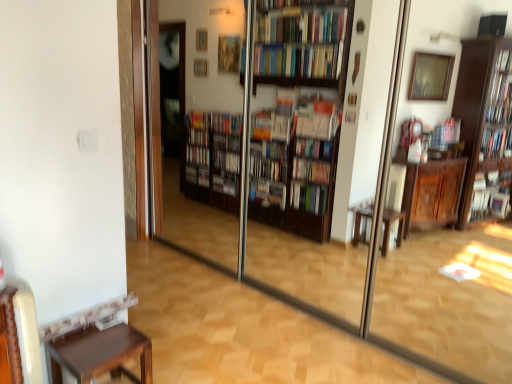
Where is `brown wood stool at lower left`? brown wood stool at lower left is located at coordinates (96, 346).

The image size is (512, 384). What do you see at coordinates (96, 346) in the screenshot? I see `brown wood stool at lower left` at bounding box center [96, 346].

Find the location of a particular element. transparent glass screen door at center is located at coordinates (271, 195).

The width and height of the screenshot is (512, 384). Describe the element at coordinates (271, 195) in the screenshot. I see `transparent glass screen door at center` at that location.

The width and height of the screenshot is (512, 384). I want to click on brown wood stool at lower left, so click(x=96, y=346).

Considering the relative positions of transparent glass screen door at center and brown wood stool at lower left in the image provided, is transparent glass screen door at center to the left of brown wood stool at lower left from the viewer's perspective?

No, transparent glass screen door at center is not to the left of brown wood stool at lower left.

Is transparent glass screen door at center in front of or behind brown wood stool at lower left in the image?

transparent glass screen door at center is positioned closer to the viewer than brown wood stool at lower left.

Does point (330, 29) appear closer or farther from the camera than point (80, 370)?

Point (330, 29) appears to be farther away from the viewer than point (80, 370).

From the image's perspective, between transparent glass screen door at center and brown wood stool at lower left, which one is located above?

transparent glass screen door at center.

From a real-world perspective, which is physically above, transparent glass screen door at center or brown wood stool at lower left?

From a 3D spatial view, transparent glass screen door at center is above.

Looking at their sizes, would you say transparent glass screen door at center is wider or thinner than brown wood stool at lower left?

transparent glass screen door at center is thinner than brown wood stool at lower left.

Is transparent glass screen door at center taller or shorter than brown wood stool at lower left?

Considering their sizes, transparent glass screen door at center has more height than brown wood stool at lower left.

Looking at this image, who is bigger, transparent glass screen door at center or brown wood stool at lower left?

With larger size is transparent glass screen door at center.

Is transparent glass screen door at center outside of brown wood stool at lower left?

Yes.

Are transparent glass screen door at center and brown wood stool at lower left located far from each other?

Yes, transparent glass screen door at center and brown wood stool at lower left are located far from each other.

Is transparent glass screen door at center aimed at brown wood stool at lower left?

Yes, transparent glass screen door at center is oriented towards brown wood stool at lower left.

At what (x,y) coordinates should I click in order to perform the action: click on screen door above the brown wood stool at lower left (from the image's perspective). Please return your answer as a coordinate pair (x, y). Looking at the image, I should click on (271, 195).

Is brown wood stool at lower left to the right of transparent glass screen door at center from the viewer's perspective?

Incorrect, brown wood stool at lower left is not on the right side of transparent glass screen door at center.

Is the depth of brown wood stool at lower left greater than that of transparent glass screen door at center?

Yes, the depth of brown wood stool at lower left is greater than that of transparent glass screen door at center.

Does point (128, 352) appear closer or farther from the camera than point (295, 239)?

Point (128, 352).

From the image's perspective, who appears lower, brown wood stool at lower left or transparent glass screen door at center?

brown wood stool at lower left is shown below in the image.

From a real-world perspective, does brown wood stool at lower left sit lower than transparent glass screen door at center?

Correct, in the physical world, brown wood stool at lower left is lower than transparent glass screen door at center.

Considering the sizes of objects brown wood stool at lower left and transparent glass screen door at center in the image provided, who is thinner, brown wood stool at lower left or transparent glass screen door at center?

→ With smaller width is transparent glass screen door at center.

Which of these two, brown wood stool at lower left or transparent glass screen door at center, stands taller?

transparent glass screen door at center.

Is brown wood stool at lower left bigger or smaller than transparent glass screen door at center?

Clearly, brown wood stool at lower left is smaller in size than transparent glass screen door at center.

Do you think brown wood stool at lower left is within transparent glass screen door at center, or outside of it?

brown wood stool at lower left is located beyond the bounds of transparent glass screen door at center.

Is brown wood stool at lower left touching transparent glass screen door at center?

No, brown wood stool at lower left is not beside transparent glass screen door at center.

Is brown wood stool at lower left positioned with its back to transparent glass screen door at center?

That's not correct — brown wood stool at lower left is not looking away from transparent glass screen door at center.

How many degrees apart are the facing directions of brown wood stool at lower left and transparent glass screen door at center?

The angle between the facing direction of brown wood stool at lower left and the facing direction of transparent glass screen door at center is 90.3 degrees.

The image size is (512, 384). Find the location of `screen door above the brown wood stool at lower left (from a real-world perspective)`. screen door above the brown wood stool at lower left (from a real-world perspective) is located at coordinates (271, 195).

Find the location of a particular element. The height and width of the screenshot is (384, 512). furniture below the transparent glass screen door at center (from the image's perspective) is located at coordinates (96, 346).

Image resolution: width=512 pixels, height=384 pixels. Find the location of `screen door lying in front of the brown wood stool at lower left`. screen door lying in front of the brown wood stool at lower left is located at coordinates (271, 195).